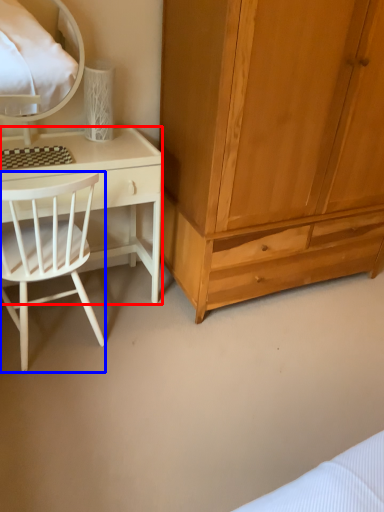
Question: Which object is further to the camera taking this photo, desk (highlighted by a red box) or chair (highlighted by a blue box)?

Choices:
 (A) desk
 (B) chair

Answer: (A)